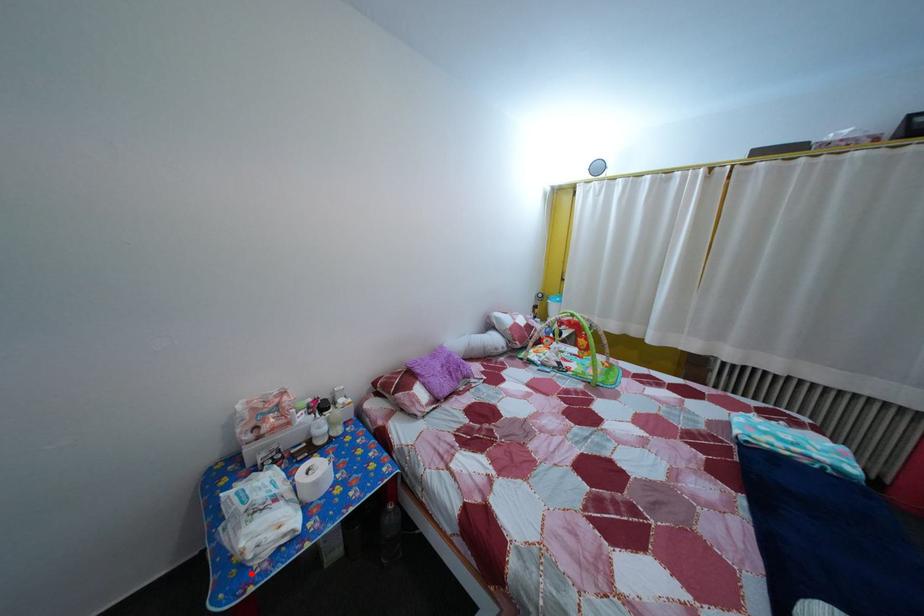
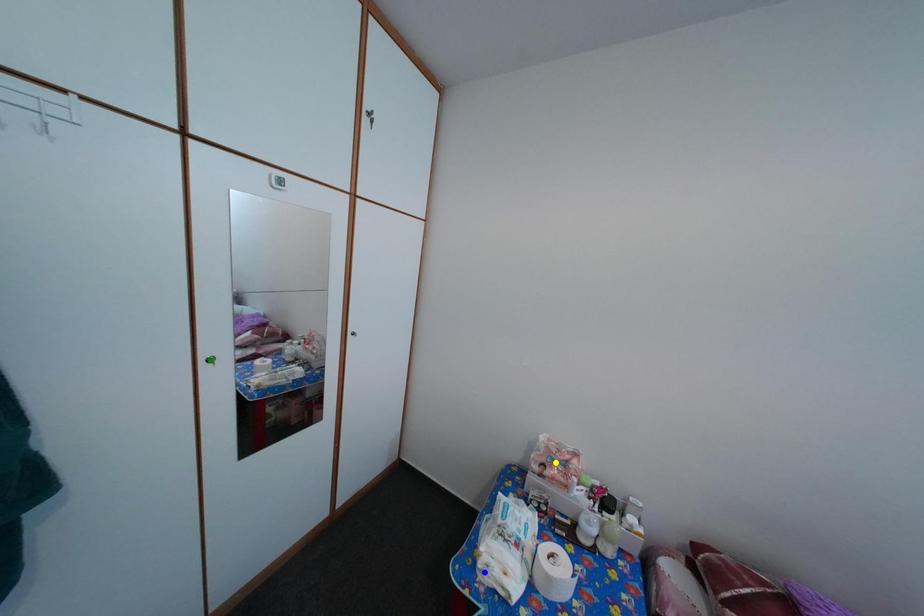
Question: I am providing you with two images of the same scene from different viewpoints. A red point is marked on the first image. You are given multiple points on the second image. In image 2, which mark is for the same physical point as the one in image 1?

Choices:
 (A) blue point
 (B) yellow point
 (C) green point

Answer: (A)